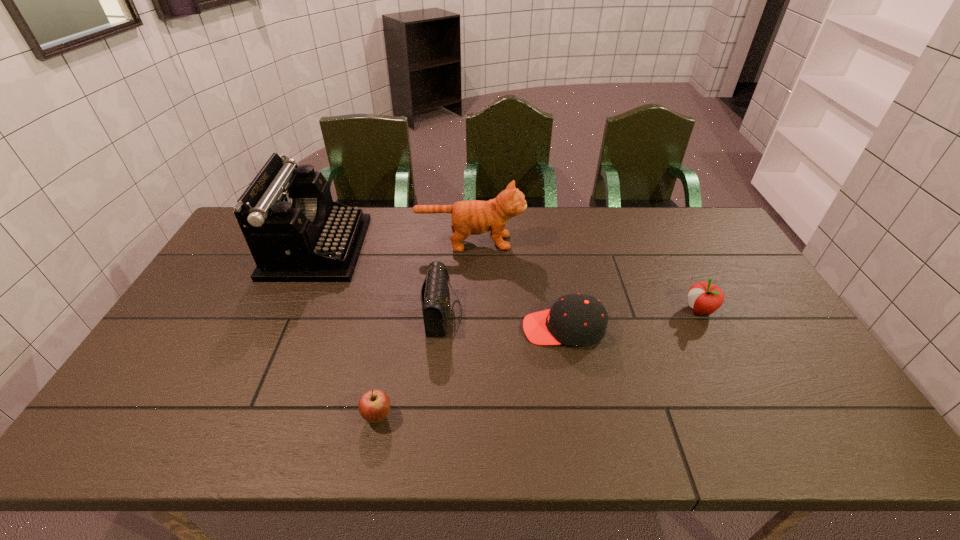
The image size is (960, 540). Identify the location of free space located on the face of the cat. (590, 242).

Locate an element on the screen. blank area located on the front flap of the clutch bag is located at coordinates (556, 313).

At what (x,y) coordinates should I click in order to perform the action: click on vacant area situated 0.360m on the front of the rightmost object. Please return your answer as a coordinate pair (x, y). This screenshot has width=960, height=540. Looking at the image, I should click on (767, 443).

This screenshot has width=960, height=540. I want to click on vacant area located on the front-facing side of the cap, so click(x=476, y=329).

You are a GUI agent. You are given a task and a screenshot of the screen. Output one action in this format:
    pyautogui.click(x=<x>, y=<y>)
    Task: Click on the free space located 0.300m on the front-facing side of the cap
    The image size is (960, 540).
    Given the screenshot: What is the action you would take?
    pyautogui.click(x=415, y=329)

The width and height of the screenshot is (960, 540). What are the coordinates of `vacant area situated 0.330m on the front-facing side of the cap` in the screenshot? It's located at (404, 329).

Identify the location of free space located 0.110m on the right of the left apple. The width and height of the screenshot is (960, 540). (440, 416).

Find the location of `typewriter that is at the far edge`. typewriter that is at the far edge is located at coordinates (295, 232).

Identify the location of cat that is at the far edge. The image size is (960, 540). tap(473, 217).

The image size is (960, 540). Find the location of `object present at the near edge`. object present at the near edge is located at coordinates (374, 405).